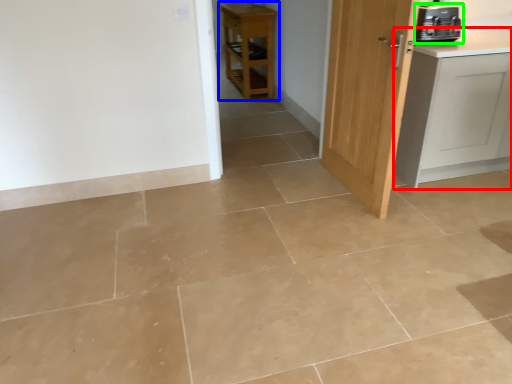
Question: Which object is the closest to the cabinetry (highlighted by a red box)? Choose among these: furniture (highlighted by a blue box) or home appliance (highlighted by a green box).

Choices:
 (A) furniture
 (B) home appliance

Answer: (B)